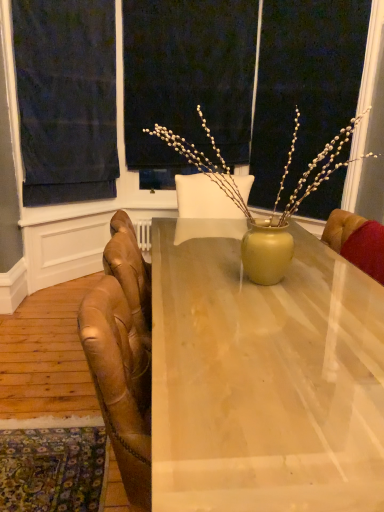
This screenshot has height=512, width=384. What are the coordinates of `dark blue fabric at upper left` in the screenshot? It's located at (66, 99).

Identify the location of leather armchair at right. The image size is (384, 512). (357, 241).

The image size is (384, 512). I want to click on dark blue fabric at upper left, so click(x=66, y=99).

Is point (274, 329) closer to viewer compared to point (69, 190)?

Yes, it is.

Considering the positions of objects matte wood desk at center and dark blue fabric at upper left in the image provided, who is more to the right, matte wood desk at center or dark blue fabric at upper left?

matte wood desk at center is more to the right.

Is matte wood desk at center closer to the viewer compared to dark blue fabric at upper left?

That is True.

Based on the photo, which of these two, matte wood desk at center or dark blue fabric at upper left, stands shorter?

matte wood desk at center.

From the image's perspective, relative to matte black screen at upper center, is dark blue fabric at upper left above or below?

Clearly, from the image's perspective, dark blue fabric at upper left is below matte black screen at upper center.

Which is correct: dark blue fabric at upper left is inside matte black screen at upper center, or outside of it?

dark blue fabric at upper left cannot be found inside matte black screen at upper center.

Which point is more forward, (107, 172) or (212, 31)?

The point (212, 31) is more forward.

Looking at this image, can you tell me how much dark blue fabric at upper left and matte black screen at upper center differ in facing direction?

The facing directions of dark blue fabric at upper left and matte black screen at upper center are 45.1 degrees apart.

Which is in front, point (160, 31) or point (156, 256)?

The point (156, 256) is more forward.

From the picture: From a real-world perspective, is matte black screen at upper center above or below matte wood desk at center?

Clearly, from a real-world perspective, matte black screen at upper center is above matte wood desk at center.

Is matte black screen at upper center aimed at matte wood desk at center?

Yes, matte black screen at upper center is aimed at matte wood desk at center.

Is matte black screen at upper center outside of matte wood desk at center?

Yes, matte black screen at upper center is not within matte wood desk at center.

Based on the photo, from a real-world perspective, is dark blue fabric at upper left physically below matte wood desk at center?

No.

Are dark blue fabric at upper left and matte wood desk at center far apart?

Yes.

In the scene shown: Considering the relative sizes of dark blue fabric at upper left and matte wood desk at center in the image provided, is dark blue fabric at upper left thinner than matte wood desk at center?

Indeed, dark blue fabric at upper left has a lesser width compared to matte wood desk at center.

Could you tell me if dark blue fabric at upper left is facing matte wood desk at center?

Yes, dark blue fabric at upper left is oriented towards matte wood desk at center.

From the picture: How many degrees apart are the facing directions of matte wood desk at center and matte black screen at upper center?

There is a 0.208-degree angle between the facing directions of matte wood desk at center and matte black screen at upper center.

Is matte wood desk at center facing away from matte black screen at upper center?

No, matte wood desk at center is not facing the opposite direction of matte black screen at upper center.

Between matte wood desk at center and matte black screen at upper center, which one is positioned in front?

matte wood desk at center is more forward.

I want to click on desk in front of the matte black screen at upper center, so [x=263, y=377].

Is matte wood desk at center facing away from leather armchair at right?

matte wood desk at center does not have its back to leather armchair at right.

From the image's perspective, is matte wood desk at center located above or below leather armchair at right?

Based on their image positions, matte wood desk at center is located beneath leather armchair at right.

Considering the points (260, 287) and (357, 248), which point is behind, point (260, 287) or point (357, 248)?

The point (357, 248) is more distant.

In the scene shown: Between leather armchair at right and matte black screen at upper center, which one has larger size?

matte black screen at upper center is bigger.

Considering the sizes of objects leather armchair at right and matte black screen at upper center in the image provided, who is thinner, leather armchair at right or matte black screen at upper center?

matte black screen at upper center.

From the image's perspective, is leather armchair at right under matte black screen at upper center?

Indeed, from the image's perspective, leather armchair at right is shown beneath matte black screen at upper center.

Considering the sizes of objects leather armchair at right and matte black screen at upper center in the image provided, who is taller, leather armchair at right or matte black screen at upper center?

matte black screen at upper center.

Identify the location of desk that appears on the right of dark blue fabric at upper left. (263, 377).

This screenshot has width=384, height=512. I want to click on window screen that is above the dark blue fabric at upper left (from the image's perspective), so click(x=187, y=81).

Based on their spatial positions, is dark blue fabric at upper left or matte wood desk at center further from matte black screen at upper center?

matte wood desk at center lies further to matte black screen at upper center than the other object.

From the picture: Looking at the image, which one is located further to leather armchair at right, matte wood desk at center or matte black screen at upper center?

Among the two, matte black screen at upper center is located further to leather armchair at right.

Which object lies further to the anchor point matte wood desk at center, matte black screen at upper center or dark blue fabric at upper left?

matte black screen at upper center is further to matte wood desk at center.

Which object lies further to the anchor point leather armchair at right, matte black screen at upper center or dark blue fabric at upper left?

Among the two, dark blue fabric at upper left is located further to leather armchair at right.

Looking at the image, which one is located further to matte black screen at upper center, matte wood desk at center or leather armchair at right?

matte wood desk at center is further to matte black screen at upper center.

Based on their spatial positions, is matte wood desk at center or matte black screen at upper center closer to dark blue fabric at upper left?

matte black screen at upper center.

From the picture: From the image, which object appears to be nearer to matte black screen at upper center, dark blue fabric at upper left or leather armchair at right?

A: dark blue fabric at upper left lies closer to matte black screen at upper center than the other object.

When comparing their distances from dark blue fabric at upper left, does matte wood desk at center or leather armchair at right seem closer?

matte wood desk at center is closer to dark blue fabric at upper left.

Locate an element on the screen. chair between matte wood desk at center and matte black screen at upper center from front to back is located at coordinates (357, 241).

You are a GUI agent. You are given a task and a screenshot of the screen. Output one action in this format:
    pyautogui.click(x=<x>, y=<y>)
    Task: Click on the curtain positioned between matte wood desk at center and matte black screen at upper center from near to far
    
    Given the screenshot: What is the action you would take?
    click(x=66, y=99)

This screenshot has width=384, height=512. In order to click on window screen between dark blue fabric at upper left and leather armchair at right in the horizontal direction in this screenshot , I will do `click(187, 81)`.

The image size is (384, 512). I want to click on chair between matte wood desk at center and dark blue fabric at upper left in the front-back direction, so click(x=357, y=241).